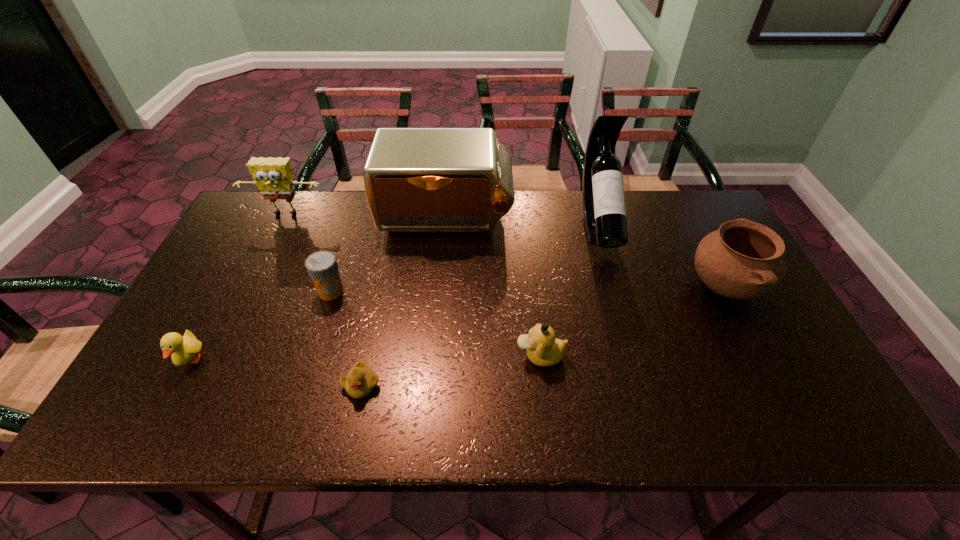
In the image, there is a desktop. In order to click on vacant space at the left edge in this screenshot , I will do `click(252, 241)`.

Find the location of a particular element. This screenshot has width=960, height=540. blank area at the right edge is located at coordinates (726, 300).

The height and width of the screenshot is (540, 960). What are the coordinates of `vacant space at the far right corner of the desktop` in the screenshot? It's located at (692, 197).

Where is `free space between the sponge and the pottery`? free space between the sponge and the pottery is located at coordinates (505, 251).

You are a GUI agent. You are given a task and a screenshot of the screen. Output one action in this format:
    pyautogui.click(x=<x>, y=<y>)
    Task: Click on the free spot between the rightmost duckling and the leftmost duckling
    Image resolution: width=960 pixels, height=540 pixels.
    Given the screenshot: What is the action you would take?
    pyautogui.click(x=366, y=358)

Where is `vacant point located between the leftmost duckling and the sponge`? vacant point located between the leftmost duckling and the sponge is located at coordinates (238, 288).

What are the coordinates of `vacant space in between the wine bottle and the shortest duckling` in the screenshot? It's located at (480, 305).

The width and height of the screenshot is (960, 540). I want to click on blank region between the rightmost object and the seventh shortest object, so click(x=585, y=253).

In order to click on free space between the third object from left to right and the wine bottle in this screenshot , I will do `click(465, 258)`.

At what (x,y) coordinates should I click in order to perform the action: click on vacant point located between the sixth object from right to left and the rightmost duckling. Please return your answer as a coordinate pair (x, y). The width and height of the screenshot is (960, 540). Looking at the image, I should click on (436, 323).